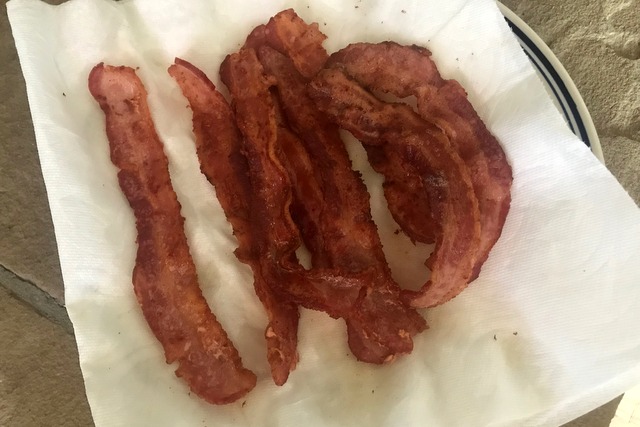
The width and height of the screenshot is (640, 427). In order to click on paper towel in this screenshot , I will do `click(577, 311)`.